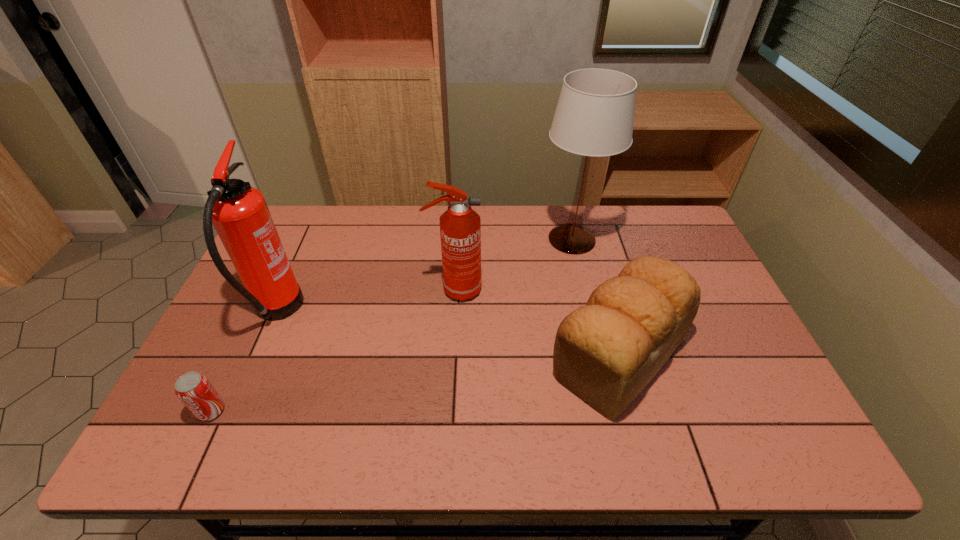
Where is `vacant space located at the nozzle of the third shortest object`? vacant space located at the nozzle of the third shortest object is located at coordinates (565, 290).

In order to click on free space located on the left of the bread in this screenshot , I will do `click(527, 355)`.

Find the location of a particular element. The image size is (960, 540). object located at the far edge is located at coordinates (594, 116).

Locate an element on the screen. Image resolution: width=960 pixels, height=540 pixels. bread positioned at the near edge is located at coordinates (606, 352).

Locate an element on the screen. This screenshot has height=540, width=960. soda can present at the near edge is located at coordinates (195, 391).

The height and width of the screenshot is (540, 960). Find the location of `fire extinguisher that is at the left edge`. fire extinguisher that is at the left edge is located at coordinates (239, 213).

What are the coordinates of `soda can at the left edge` in the screenshot? It's located at (x=195, y=391).

The height and width of the screenshot is (540, 960). Identify the location of object present at the right edge. (606, 352).

This screenshot has height=540, width=960. In order to click on object that is at the near left corner in this screenshot , I will do `click(195, 391)`.

Identify the location of object positioned at the near right corner. (606, 352).